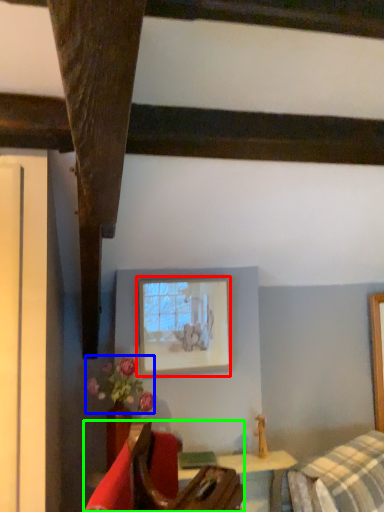
Question: Which object is the farthest from picture frame (highlighted by a red box)? Choose among these: flower (highlighted by a blue box) or furniture (highlighted by a green box).

Choices:
 (A) flower
 (B) furniture

Answer: (B)